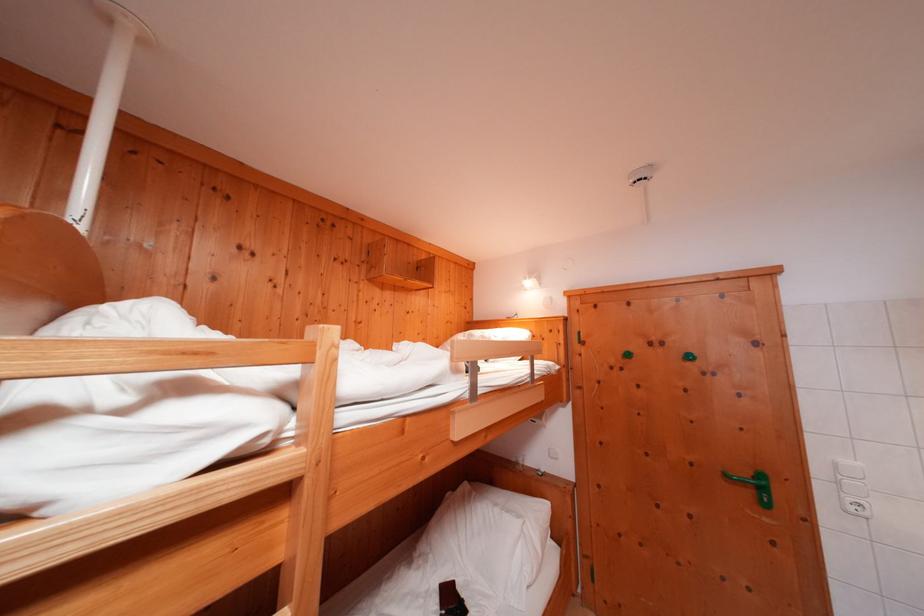
Where is `wooden ladder rung`? The height and width of the screenshot is (616, 924). wooden ladder rung is located at coordinates (472, 379).